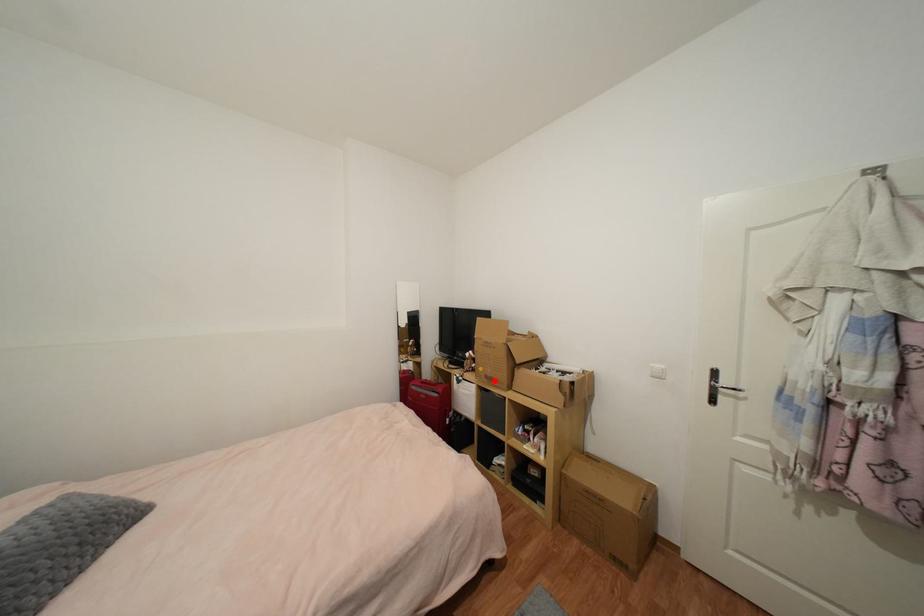
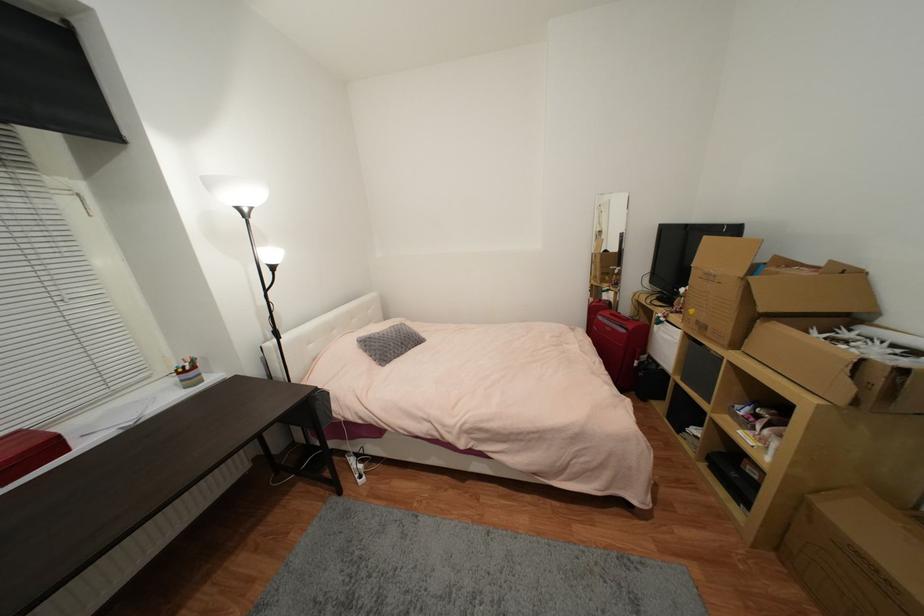
In the second image, find the point that corresponds to the highlighted location in the first image.

(708, 329)